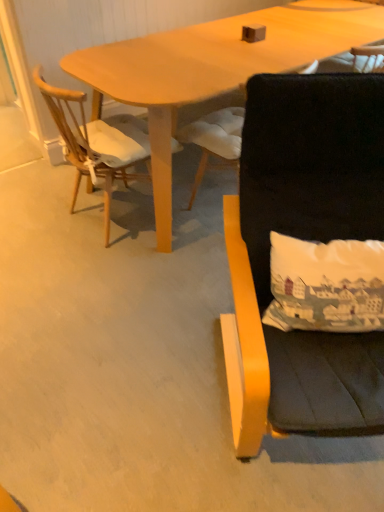
Identify the location of free space that is to the left of wooden chair at left, marked as the 1th chair in a left-to-right arrangement. (38, 215).